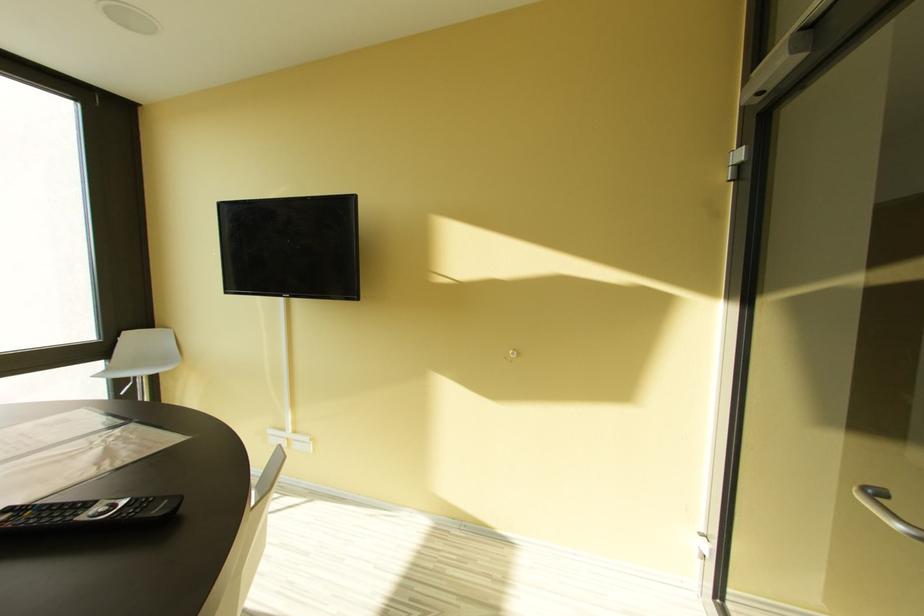
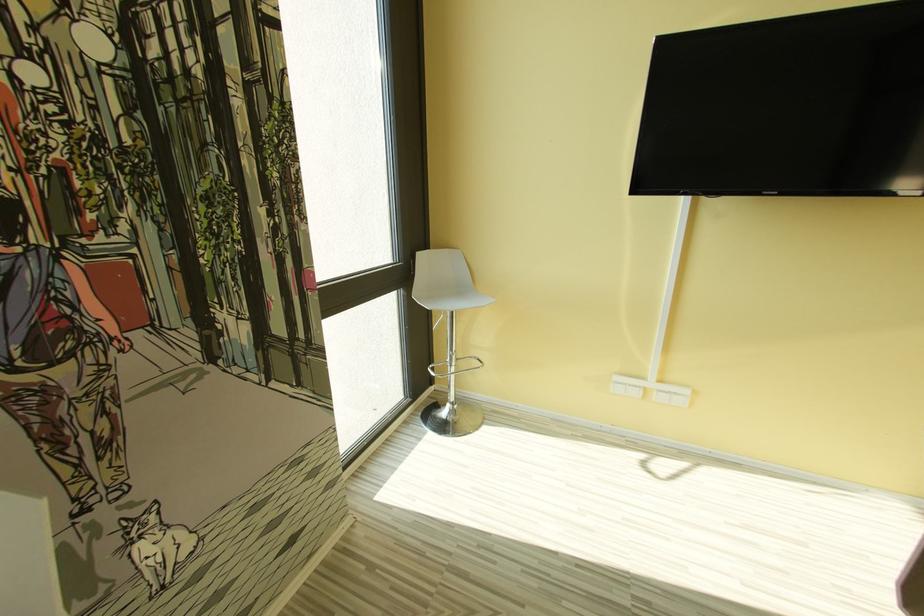
Question: In a continuous first-person perspective shot, in which direction is the camera moving?

Choices:
 (A) Left
 (B) Right
 (C) Forward
 (D) Backward

Answer: (A)